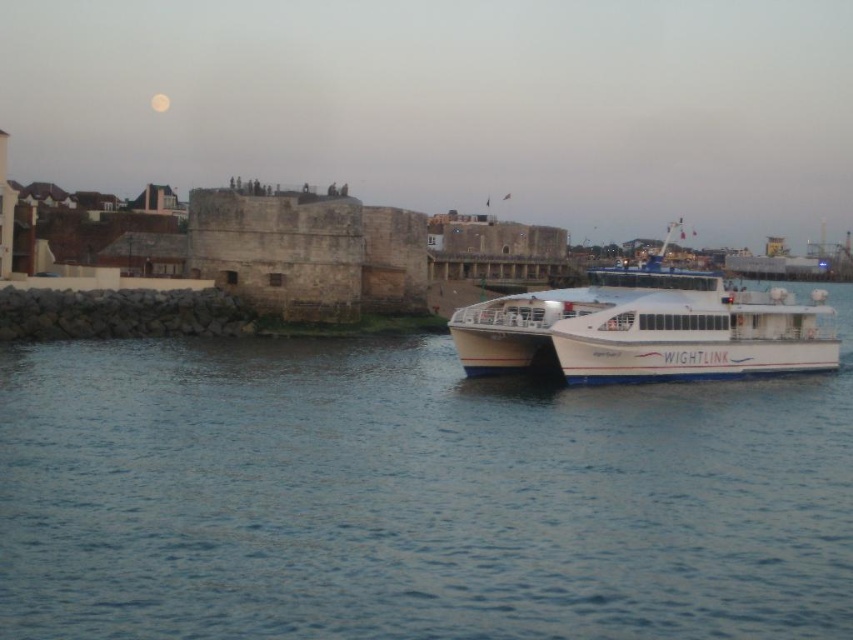
You are standing at the waterfront and want to take a photo of the ferry boat and the historic stone structure. The ferry boat is at point (297, 396) and the historic stone structure is at point (505, 349). Which point is closer to you so that you can focus your camera properly?

Point (297, 396) is closer to the camera than point (505, 349), so you should focus your camera on the ferry boat at point (297, 396) first as it is nearer.

You are a photographer trying to capture the ferry and the water in one shot. Since the blue water at center and the white matte ferry at right are both in your frame, which one appears taller in the photo?

The white matte ferry at right appears taller than the blue water at center in the photo because the blue water at center has a lesser height compared to the white matte ferry at right.